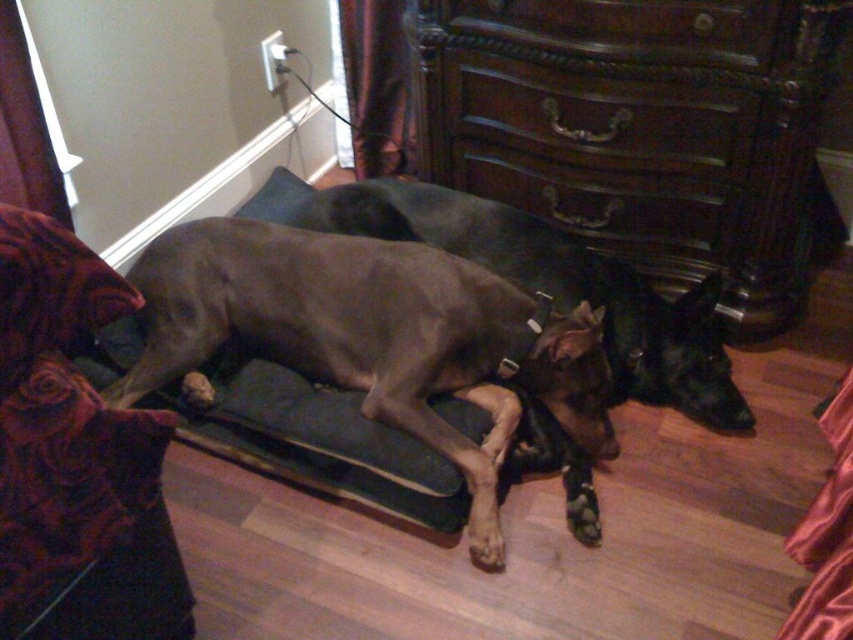
You are organizing a small party and need to place a 1.2 meter long tablecloth on the dark wood dresser at center. Can the tablecloth fit if the smooth gray dog at center is currently occupying space on the dresser?

The dark wood dresser at center is larger in size than the smooth gray dog at center. However, the description does not provide specific dimensions for either item, so it is uncertain whether the 1.2 meter tablecloth will fit. Additional measurements are needed to determine this.